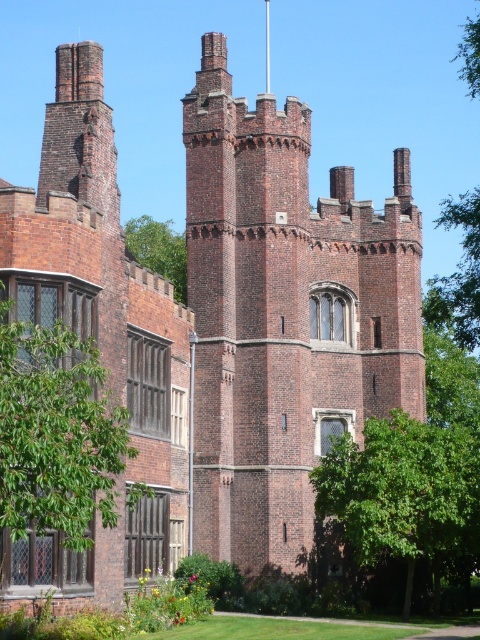
Does green leafy tree at left have a larger size compared to green leafy tree at upper left?

No, green leafy tree at left is not bigger than green leafy tree at upper left.

Which is more to the right, green leafy tree at left or green leafy tree at upper left?

green leafy tree at left is more to the right.

The image size is (480, 640). What do you see at coordinates (57, 433) in the screenshot?
I see `green leafy tree at left` at bounding box center [57, 433].

Where is `green leafy tree at left`? The height and width of the screenshot is (640, 480). green leafy tree at left is located at coordinates pos(57,433).

Can you confirm if green leafy tree at center is positioned below green leafy tree at upper left?

Yes, green leafy tree at center is below green leafy tree at upper left.

Is green leafy tree at center in front of green leafy tree at upper left?

Yes, it is in front of green leafy tree at upper left.

Which is in front, point (321, 460) or point (172, 257)?

Point (321, 460)

You are a GUI agent. You are given a task and a screenshot of the screen. Output one action in this format:
    pyautogui.click(x=<x>, y=<y>)
    Task: Click on the green leafy tree at center
    The width and height of the screenshot is (480, 640).
    Given the screenshot: What is the action you would take?
    405,496

Does green leafy tree at left have a lesser width compared to green leafy tree at center?

Yes.

Between point (70, 477) and point (348, 440), which one is positioned behind?

The point (348, 440) is behind.

You are a GUI agent. You are given a task and a screenshot of the screen. Output one action in this format:
    pyautogui.click(x=<x>, y=<y>)
    Task: Click on the green leafy tree at left
    This screenshot has width=480, height=640.
    Given the screenshot: What is the action you would take?
    pyautogui.click(x=57, y=433)